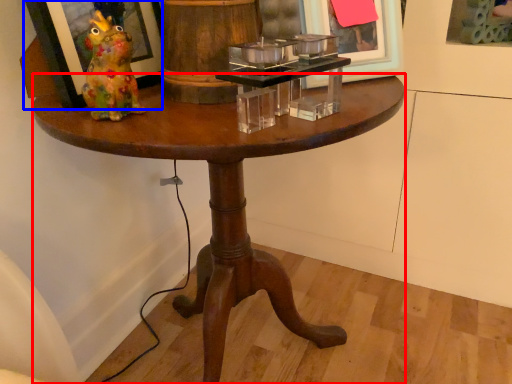
Question: Which of the following is the closest to the observer, coffee table (highlighted by a red box) or picture frame (highlighted by a blue box)?

Choices:
 (A) coffee table
 (B) picture frame

Answer: (A)